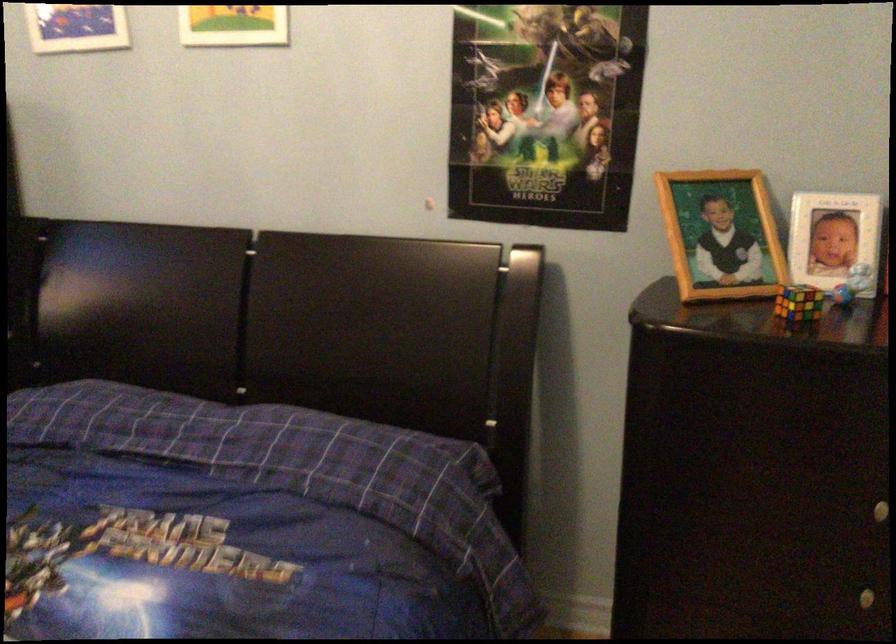
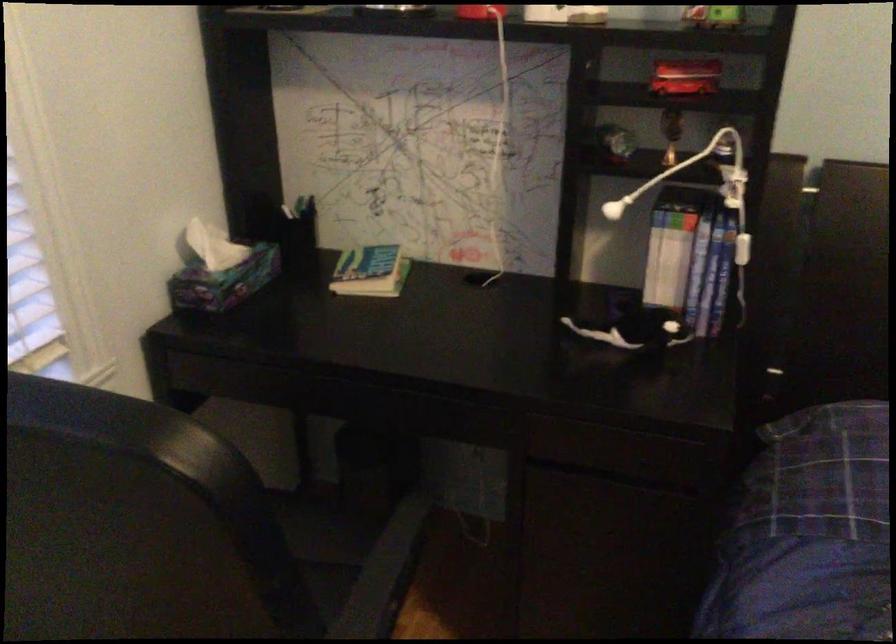
Which direction would the cameraman need to move to produce the second image?

The movement direction of the cameraman is left, forward.